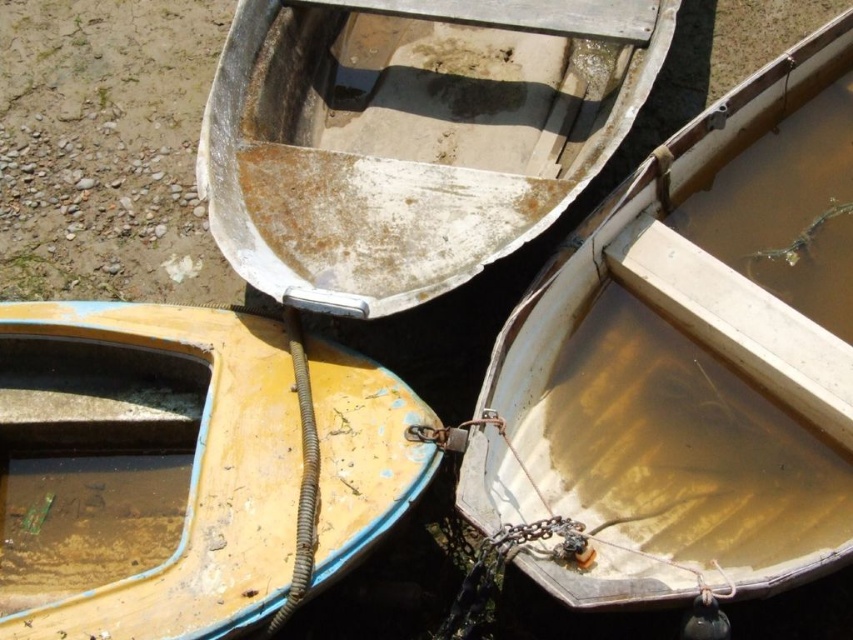
Consider the image. Who is lower down, white weathered wood boat at upper center or wooden boat at center?

wooden boat at center

Who is more forward, (401,308) or (635,547)?

Point (635,547) is in front.

Is point (485, 81) positioned in front of point (653, 166)?

That is False.

Identify the location of white weathered wood boat at upper center. This screenshot has width=853, height=640. (410, 136).

Who is lower down, yellow matte boat at lower left or white weathered wood boat at upper center?

yellow matte boat at lower left is below.

Is point (183, 369) farther from viewer compared to point (535, 28)?

No, (183, 369) is closer to viewer.

Locate an element on the screen. The image size is (853, 640). yellow matte boat at lower left is located at coordinates (143, 470).

Which is behind, point (279, 584) or point (776, 77)?

Point (776, 77)

Which is more to the right, yellow matte boat at lower left or wooden boat at center?

wooden boat at center

Between point (157, 628) and point (778, 92), which one is positioned behind?

The point (778, 92) is behind.

At what (x,y) coordinates should I click in order to perform the action: click on yellow matte boat at lower left. Please return your answer as a coordinate pair (x, y). The image size is (853, 640). Looking at the image, I should click on (143, 470).